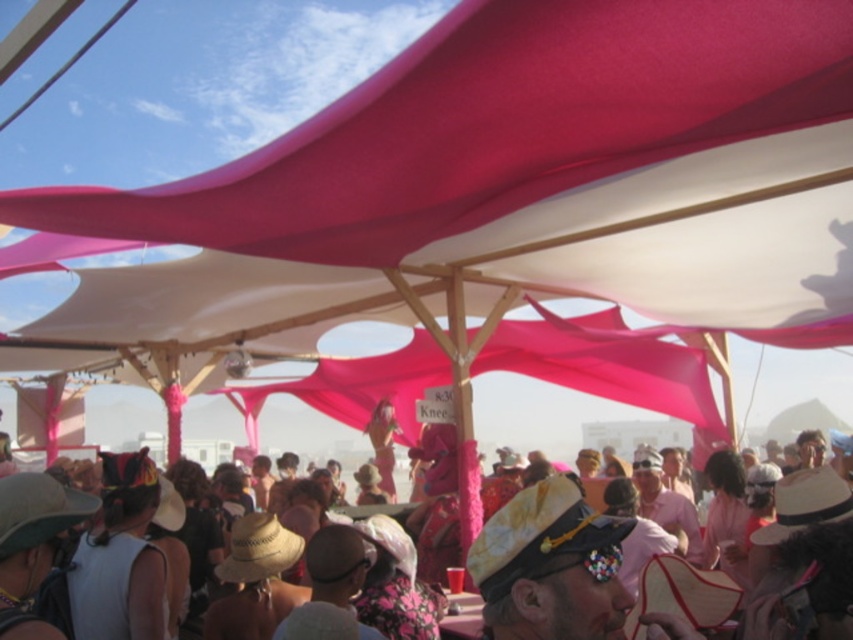
You are at the outdoor gathering and want to find the pink fabric canopy at center. From the matte pink fabric canopy at upper center, which direction should you move to locate it?

The matte pink fabric canopy at upper center is positioned on the left side of the pink fabric canopy at center, so you should move to the right to locate the pink fabric canopy at center.

You are standing under the tents and want to locate the matte pink fabric canopy at upper center. According to the coordinates provided, where should you look? Please provide the coordinates in the format of a point like this example format point_x, point_y. The answer should be in the form of a point with two decimal places.

The coordinates for the matte pink fabric canopy at upper center are (527, 172).

You are at the outdoor gathering and want to find shade under the tents. Which canopy, the matte pink fabric canopy at upper center or the pink fabric canopy at center, is positioned higher and thus might provide better overhead shade?

The matte pink fabric canopy at upper center is located above the pink fabric canopy at center, so it is positioned higher and would provide better overhead shade.